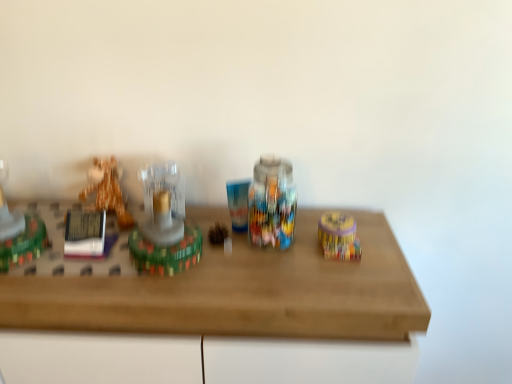
Image resolution: width=512 pixels, height=384 pixels. I want to click on free space in front of matte yellow container at right, which ranks as the 4th toy in left-to-right order, so click(x=341, y=278).